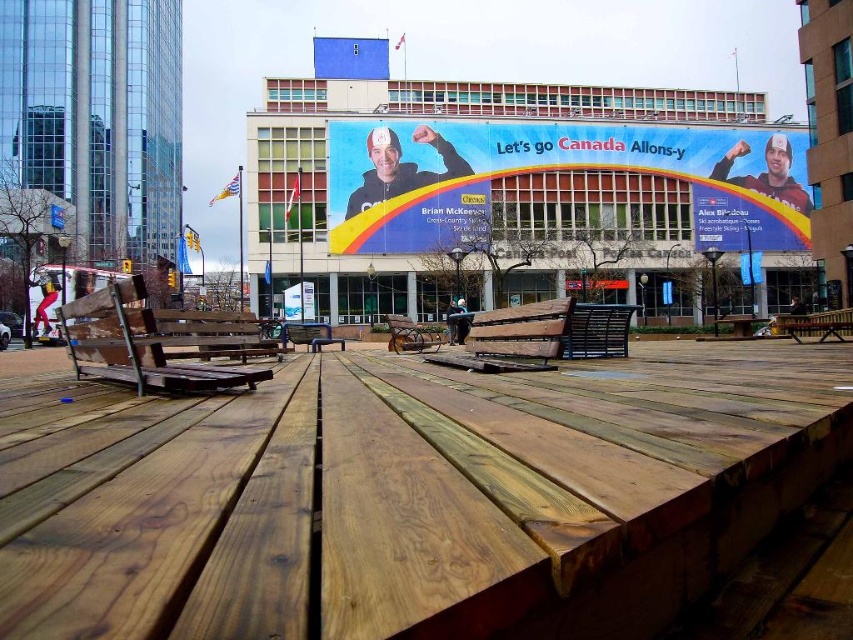
Which is in front, point (427, 355) or point (596, 304)?

Point (427, 355) is more forward.

Can you confirm if natural wood park bench at center is positioned to the right of dark brown wood park bench at center?

Incorrect, natural wood park bench at center is not on the right side of dark brown wood park bench at center.

Between point (492, 314) and point (593, 307), which one is positioned in front?

Point (492, 314)

Locate an element on the screen. The height and width of the screenshot is (640, 853). natural wood park bench at center is located at coordinates (512, 339).

Between dark brown wood park bench at center and wooden park bench at center, which one appears on the right side from the viewer's perspective?

Positioned to the right is dark brown wood park bench at center.

Locate an element on the screen. dark brown wood park bench at center is located at coordinates (x=596, y=330).

Can you confirm if wooden bench at center is wider than wooden park bench at center?

Yes, wooden bench at center is wider than wooden park bench at center.

Is wooden bench at center smaller than wooden park bench at center?

No, wooden bench at center is not smaller than wooden park bench at center.

Between point (784, 317) and point (428, 344), which one is positioned in front?

Point (428, 344)

At what (x,y) coordinates should I click in order to perform the action: click on wooden bench at center. Please return your answer as a coordinate pair (x, y). The width and height of the screenshot is (853, 640). Looking at the image, I should click on (814, 323).